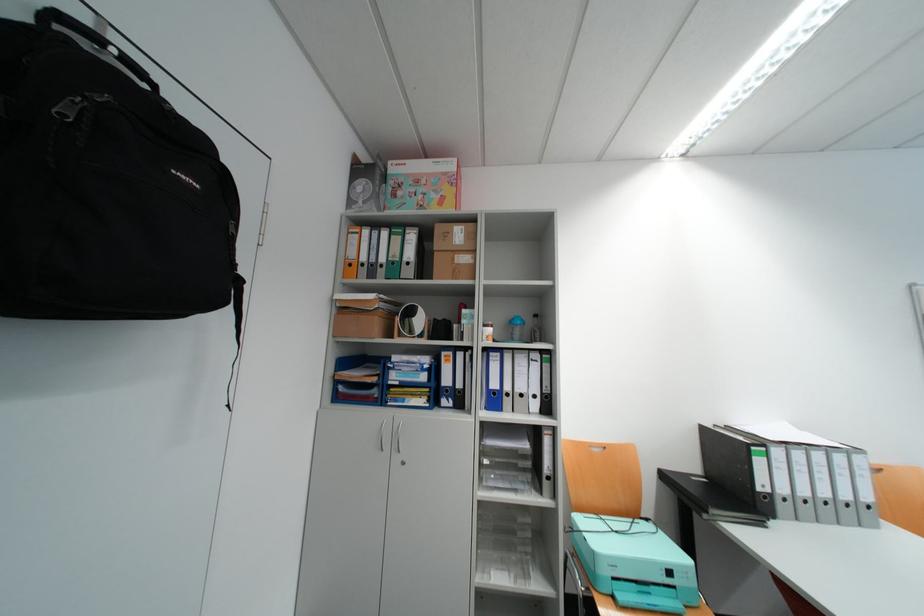
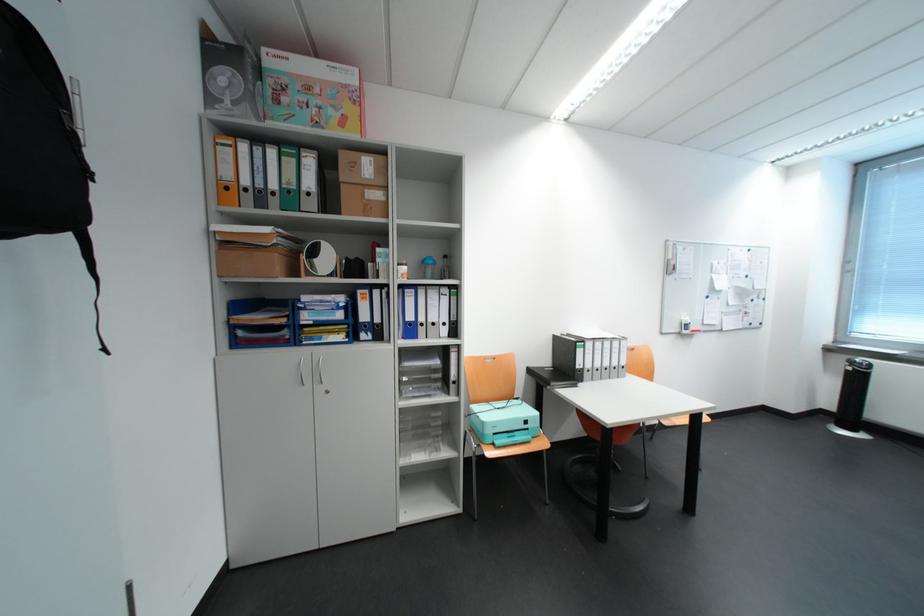
In the second image, find the point that corresponds to point (518, 330) in the first image.

(432, 270)